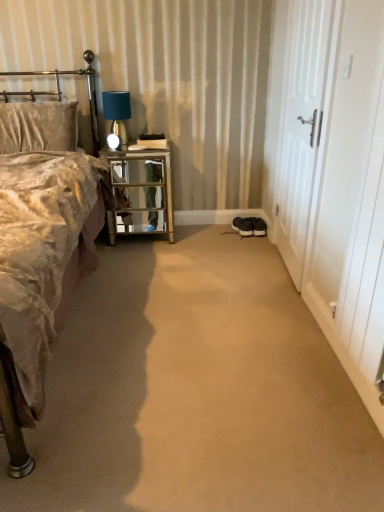
Question: From the image's perspective, is metallic gold headboard at upper left beneath velvet gold bed at left?

Choices:
 (A) no
 (B) yes

Answer: (A)

Question: Is metallic gold headboard at upper left further to the viewer compared to velvet gold bed at left?

Choices:
 (A) no
 (B) yes

Answer: (B)

Question: Considering the relative sizes of metallic gold headboard at upper left and velvet gold bed at left in the image provided, is metallic gold headboard at upper left shorter than velvet gold bed at left?

Choices:
 (A) yes
 (B) no

Answer: (A)

Question: From a real-world perspective, is metallic gold headboard at upper left on velvet gold bed at left?

Choices:
 (A) yes
 (B) no

Answer: (A)

Question: Is metallic gold headboard at upper left at the left side of velvet gold bed at left?

Choices:
 (A) no
 (B) yes

Answer: (B)

Question: Do you think white wooden door at right, the 1th screen door from the back, is within white wooden screen door at right, the 2th screen door when ordered from back to front, or outside of it?

Choices:
 (A) inside
 (B) outside

Answer: (B)

Question: From a real-world perspective, is white wooden door at right, the 1th screen door from the back, above or below white wooden screen door at right, the 2th screen door when ordered from back to front?

Choices:
 (A) above
 (B) below

Answer: (A)

Question: Is point (296, 221) closer or farther from the camera than point (352, 162)?

Choices:
 (A) farther
 (B) closer

Answer: (A)

Question: Looking at their shapes, would you say white wooden door at right, the 2th screen door in the front-to-back sequence, is wider or thinner than white wooden screen door at right, the 1th screen door viewed from the front?

Choices:
 (A) wide
 (B) thin

Answer: (B)

Question: Considering the positions of point (107, 114) and point (258, 231), is point (107, 114) closer or farther from the camera than point (258, 231)?

Choices:
 (A) closer
 (B) farther

Answer: (A)

Question: From their relative heights in the image, would you say matte blue glass table lamp at upper left is taller or shorter than black suede sneakers at lower center?

Choices:
 (A) tall
 (B) short

Answer: (A)

Question: From the image's perspective, relative to black suede sneakers at lower center, is matte blue glass table lamp at upper left above or below?

Choices:
 (A) below
 (B) above

Answer: (B)

Question: Is matte blue glass table lamp at upper left to the left or to the right of black suede sneakers at lower center in the image?

Choices:
 (A) right
 (B) left

Answer: (B)

Question: Do you think metallic gold headboard at upper left is within black suede sneakers at lower center, or outside of it?

Choices:
 (A) outside
 (B) inside

Answer: (A)

Question: Based on their positions, is metallic gold headboard at upper left located to the left or right of black suede sneakers at lower center?

Choices:
 (A) right
 (B) left

Answer: (B)